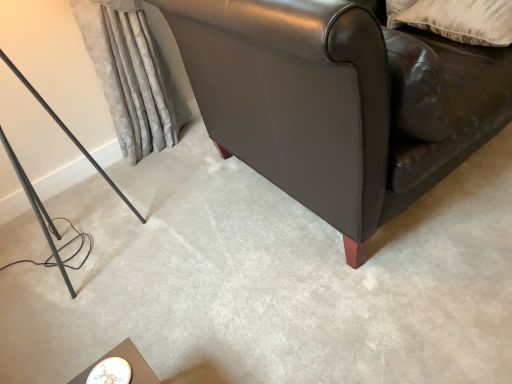
Where is `leather couch at lower right`? The height and width of the screenshot is (384, 512). leather couch at lower right is located at coordinates (339, 102).

This screenshot has width=512, height=384. I want to click on beige textured pillow at upper right, so click(457, 19).

Measure the distance between point (393, 3) and camera.

A distance of 5.47 feet exists between point (393, 3) and camera.

Where is `silky gray curtain at left`? silky gray curtain at left is located at coordinates (132, 77).

Looking at their sizes, would you say marble top table at lower left is wider or thinner than matte black leather couch at upper right?

Considering their sizes, marble top table at lower left looks slimmer than matte black leather couch at upper right.

Based on the photo, which is closer to the camera, (130, 381) or (165, 307)?

Point (130, 381).

Can you confirm if marble top table at lower left is shorter than matte black leather couch at upper right?

Correct, marble top table at lower left is not as tall as matte black leather couch at upper right.

Considering the sizes of objects leather couch at lower right and silky gray curtain at left in the image provided, who is shorter, leather couch at lower right or silky gray curtain at left?

With less height is silky gray curtain at left.

Does leather couch at lower right lie in front of silky gray curtain at left?

Yes, the depth of leather couch at lower right is less than that of silky gray curtain at left.

Is leather couch at lower right next to silky gray curtain at left and touching it?

No, leather couch at lower right is not in contact with silky gray curtain at left.

Is point (309, 117) positioned after point (140, 21)?

No, (309, 117) is in front of (140, 21).

Considering the relative sizes of leather couch at lower right and matte black leather couch at upper right in the image provided, is leather couch at lower right shorter than matte black leather couch at upper right?

Incorrect, the height of leather couch at lower right does not fall short of that of matte black leather couch at upper right.

How distant is leather couch at lower right from matte black leather couch at upper right?

leather couch at lower right is 18.32 inches away from matte black leather couch at upper right.

Does point (243, 144) come closer to viewer compared to point (59, 281)?

No.

From the image's perspective, is silky gray curtain at left on top of beige textured pillow at upper right?

No, from the image's perspective, silky gray curtain at left is not over beige textured pillow at upper right.

Does silky gray curtain at left turn towards beige textured pillow at upper right?

No, silky gray curtain at left is not facing towards beige textured pillow at upper right.

From a real-world perspective, between silky gray curtain at left and beige textured pillow at upper right, who is vertically lower?

silky gray curtain at left.

Considering the points (134, 46) and (462, 24), which point is in front, point (134, 46) or point (462, 24)?

The point (462, 24) is more forward.

Measure the distance between silky gray curtain at left and marble top table at lower left.

They are 3.98 feet apart.

Which of these two, silky gray curtain at left or marble top table at lower left, is wider?

silky gray curtain at left is wider.

Considering the relative sizes of silky gray curtain at left and marble top table at lower left in the image provided, is silky gray curtain at left taller than marble top table at lower left?

Yes, silky gray curtain at left is taller than marble top table at lower left.

Based on the photo, is silky gray curtain at left far from marble top table at lower left?

Yes, silky gray curtain at left is far from marble top table at lower left.

Can you tell me how much matte black leather couch at upper right and leather couch at lower right differ in facing direction?

The angular difference between matte black leather couch at upper right and leather couch at lower right is 2.91e-05 degrees.

From the picture: Considering the relative positions of matte black leather couch at upper right and leather couch at lower right in the image provided, is matte black leather couch at upper right behind leather couch at lower right?

No, matte black leather couch at upper right is in front of leather couch at lower right.

This screenshot has height=384, width=512. What are the coordinates of `studio couch that is behind the matte black leather couch at upper right` in the screenshot? It's located at (339, 102).

Considering the positions of objects matte black leather couch at upper right and leather couch at lower right in the image provided, who is more to the left, matte black leather couch at upper right or leather couch at lower right?

matte black leather couch at upper right.

From the image's perspective, is leather couch at lower right above or below beige textured pillow at upper right?

From the image's perspective, leather couch at lower right appears above beige textured pillow at upper right.

Is leather couch at lower right far from beige textured pillow at upper right?

That's not correct — leather couch at lower right is a little close to beige textured pillow at upper right.

From a real-world perspective, is leather couch at lower right on top of beige textured pillow at upper right?

No, from a real-world perspective, leather couch at lower right is not over beige textured pillow at upper right

Which is more to the left, leather couch at lower right or beige textured pillow at upper right?

leather couch at lower right is more to the left.

I want to click on table behind the matte black leather couch at upper right, so click(127, 362).

This screenshot has height=384, width=512. I want to click on curtain located below the leather couch at lower right (from the image's perspective), so click(132, 77).

From the image, which object appears to be farther from leather couch at lower right, silky gray curtain at left or matte black leather couch at upper right?

Among the two, silky gray curtain at left is located further to leather couch at lower right.

Which object lies nearer to the anchor point marble top table at lower left, silky gray curtain at left or leather couch at lower right?

leather couch at lower right lies closer to marble top table at lower left than the other object.

Which object lies nearer to the anchor point silky gray curtain at left, leather couch at lower right or matte black leather couch at upper right?

Among the two, leather couch at lower right is located nearer to silky gray curtain at left.

Estimate the real-world distances between objects in this image. Which object is further from beige textured pillow at upper right, silky gray curtain at left or marble top table at lower left?

marble top table at lower left.

Looking at the image, which one is located further to matte black leather couch at upper right, leather couch at lower right or marble top table at lower left?

marble top table at lower left.

Considering their positions, is beige textured pillow at upper right positioned closer to leather couch at lower right than matte black leather couch at upper right?

matte black leather couch at upper right is closer to leather couch at lower right.

Estimate the real-world distances between objects in this image. Which object is closer to beige textured pillow at upper right, silky gray curtain at left or matte black leather couch at upper right?

Among the two, matte black leather couch at upper right is located nearer to beige textured pillow at upper right.

Which object lies further to the anchor point leather couch at lower right, matte black leather couch at upper right or silky gray curtain at left?

Among the two, silky gray curtain at left is located further to leather couch at lower right.

The height and width of the screenshot is (384, 512). Identify the location of concrete between leather couch at lower right and marble top table at lower left in the up-down direction. (270, 281).

The width and height of the screenshot is (512, 384). In order to click on studio couch between silky gray curtain at left and beige textured pillow at upper right in the horizontal direction in this screenshot , I will do `click(339, 102)`.

Where is `concrete between marble top table at lower left and beige textured pillow at upper right in the horizontal direction`? concrete between marble top table at lower left and beige textured pillow at upper right in the horizontal direction is located at coordinates (270, 281).

The image size is (512, 384). I want to click on table between silky gray curtain at left and beige textured pillow at upper right from left to right, so click(x=127, y=362).